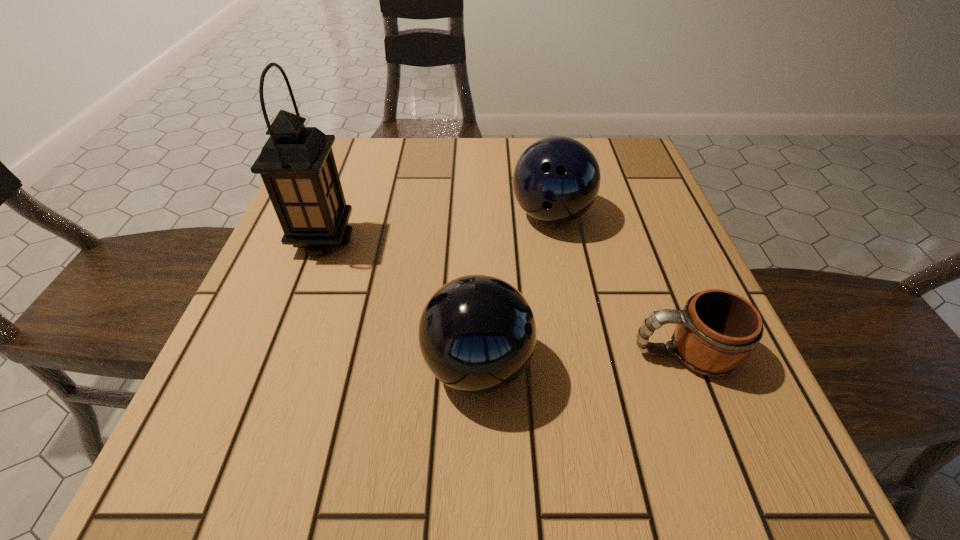
Identify the location of vacant space that's between the rightmost object and the farther bowling ball. The height and width of the screenshot is (540, 960). (617, 284).

Identify the location of free space between the rightmost object and the nearer bowling ball. The image size is (960, 540). (581, 360).

I want to click on object that is the second closest to the nearer bowling ball, so click(x=556, y=180).

Locate which object is the second closest to the nearer bowling ball. Please provide its 2D coordinates. Your answer should be formatted as a tuple, i.e. [(x, y)], where the tuple contains the x and y coordinates of a point satisfying the conditions above.

[(556, 180)]

Find the location of `free location that satisfies the following two spatial constraints: 1. on the surface of the farther bowling ball near the finger holes; 2. on the side of the nearer bowling ball with the finger holes`. free location that satisfies the following two spatial constraints: 1. on the surface of the farther bowling ball near the finger holes; 2. on the side of the nearer bowling ball with the finger holes is located at coordinates (578, 366).

Find the location of `free point that satisfies the following two spatial constraints: 1. on the surface of the farther bowling ball near the finger holes; 2. on the side of the nearer bowling ball with the finger holes`. free point that satisfies the following two spatial constraints: 1. on the surface of the farther bowling ball near the finger holes; 2. on the side of the nearer bowling ball with the finger holes is located at coordinates (578, 366).

Identify the location of vacant region that satisfies the following two spatial constraints: 1. on the surface of the farther bowling ball near the finger holes; 2. on the side of the nearer bowling ball with the finger holes. Image resolution: width=960 pixels, height=540 pixels. (578, 366).